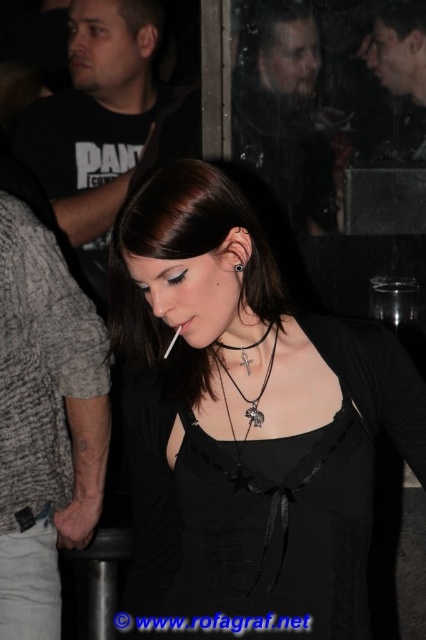
Question: Which object is farther from the camera taking this photo?

Choices:
 (A) matte black dress at center
 (B) black leather necklace with cross pendant at center

Answer: (B)

Question: Can you confirm if matte black dress at center is positioned to the right of matte black lipstick at center?

Choices:
 (A) yes
 (B) no

Answer: (A)

Question: Is matte black dress at center bigger than black leather necklace with cross pendant at center?

Choices:
 (A) no
 (B) yes

Answer: (B)

Question: Which of the following is the farthest from the observer?

Choices:
 (A) (213, 248)
 (B) (178, 328)

Answer: (B)

Question: Among these objects, which one is farthest from the camera?

Choices:
 (A) black leather necklace with cross pendant at center
 (B) matte black dress at center

Answer: (A)

Question: Can you confirm if black leather necklace with cross pendant at center is positioned below matte black lipstick at center?

Choices:
 (A) no
 (B) yes

Answer: (B)